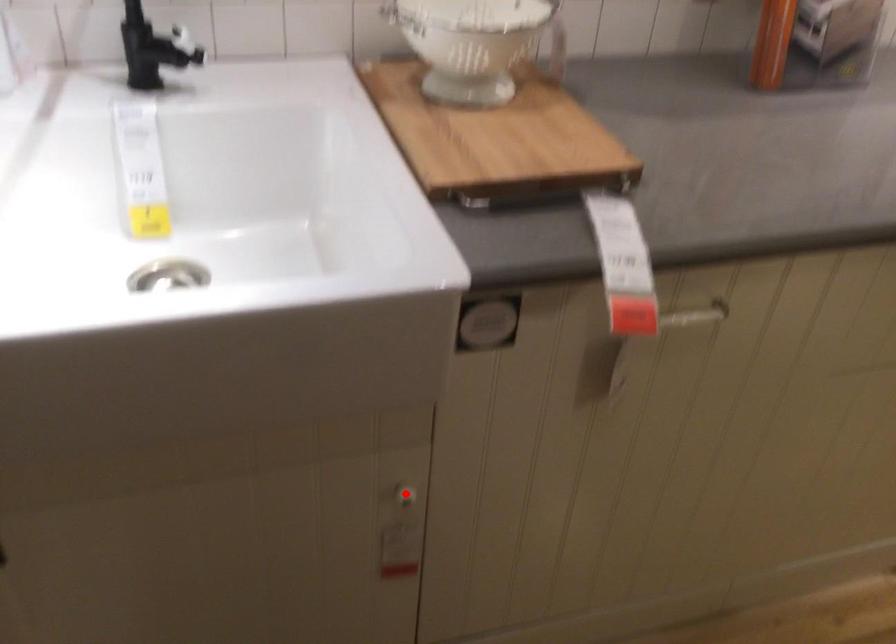
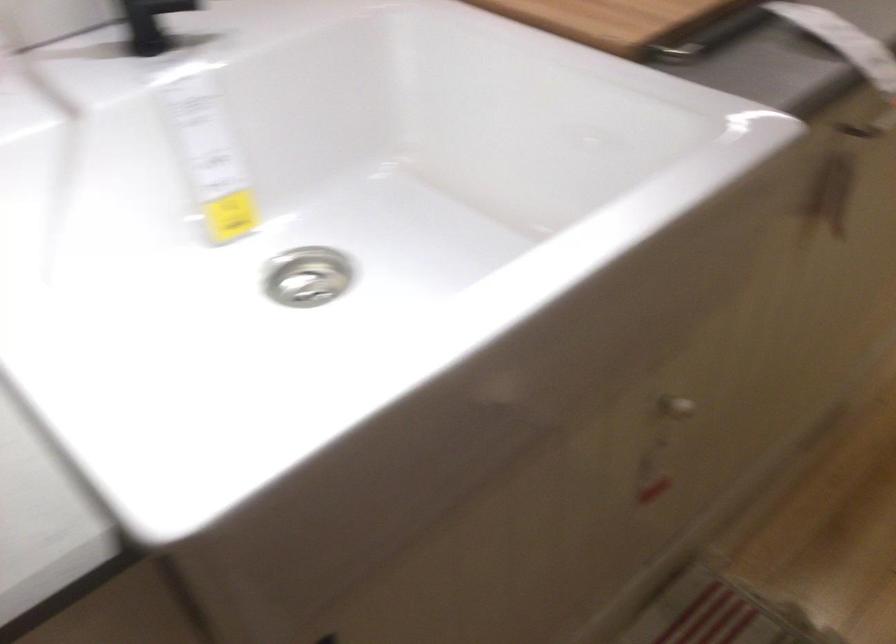
Question: I am providing you with two images of the same scene from different viewpoints. In image1, a red point is highlighted. Considering the same 3D point in image2, which of the following is correct?

Choices:
 (A) It is closer
 (B) It is farther

Answer: (A)